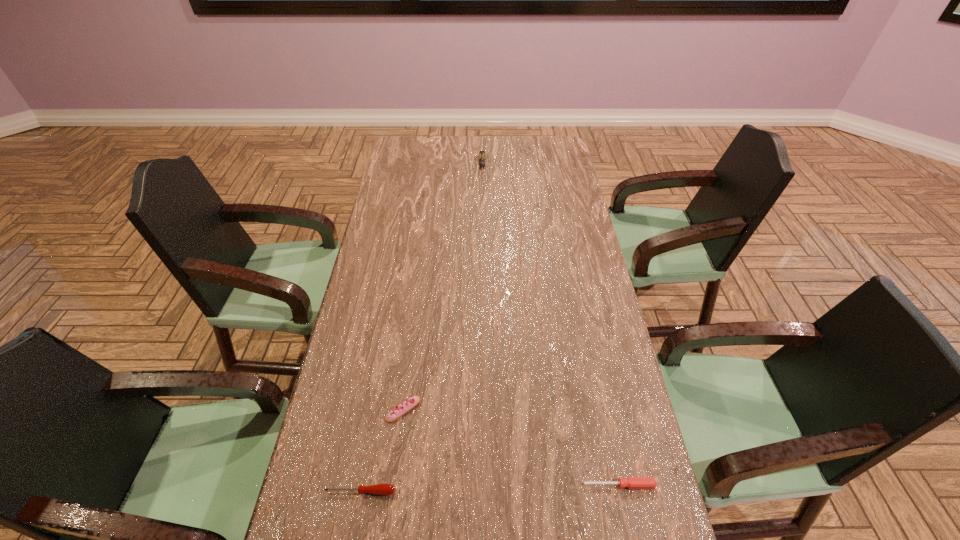
This screenshot has height=540, width=960. I want to click on the farthest screwdriver, so click(482, 153).

Find the location of a particular element. the second screwdriver from left to right is located at coordinates (482, 153).

Locate an element on the screen. eclair is located at coordinates [x=401, y=409].

Locate an element on the screen. This screenshot has height=540, width=960. the leftmost screwdriver is located at coordinates (383, 489).

You are a GUI agent. You are given a task and a screenshot of the screen. Output one action in this format:
    pyautogui.click(x=<x>, y=<y>)
    Task: Click on the rightmost object
    Image resolution: width=960 pixels, height=540 pixels.
    Given the screenshot: What is the action you would take?
    pyautogui.click(x=631, y=482)

Where is `vacant area situated insert the farthest screwdriver into a screw head`? vacant area situated insert the farthest screwdriver into a screw head is located at coordinates (483, 239).

The image size is (960, 540). In order to click on vacant space located 0.130m on the back of the eclair in this screenshot , I will do `click(410, 356)`.

The height and width of the screenshot is (540, 960). Find the location of `vacant position located on the back of the leftmost screwdriver`. vacant position located on the back of the leftmost screwdriver is located at coordinates (374, 415).

The width and height of the screenshot is (960, 540). Identify the location of vacant region located 0.340m on the left of the rightmost object. [440, 485].

Find the location of a particular element. object located at the far edge is located at coordinates (482, 153).